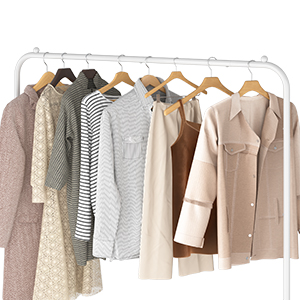
This screenshot has width=300, height=300. In order to click on hangers in this screenshot , I will do `click(41, 83)`, `click(55, 80)`, `click(88, 72)`, `click(123, 77)`, `click(147, 80)`, `click(178, 71)`, `click(210, 84)`, `click(247, 89)`.